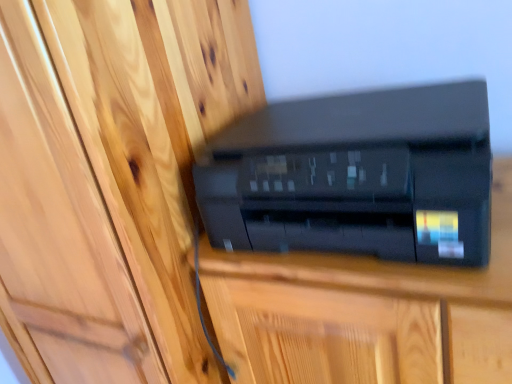
Based on the photo, what is the approximate width of black plastic printer at center?

black plastic printer at center is 40.46 centimeters wide.

In order to face matte wood door at center, should I rotate leftwards or rightwards?

It's best to rotate left around 12.061 degrees.

The image size is (512, 384). In order to click on black plastic printer at center in this screenshot , I will do `click(365, 313)`.

Between point (259, 266) and point (46, 211), which one is positioned behind?

The point (46, 211) is more distant.

In the scene shown: From the image's perspective, does black plastic printer at center appear lower than matte wood door at center?

Indeed, from the image's perspective, black plastic printer at center is shown beneath matte wood door at center.

How many degrees apart are the facing directions of black plastic printer at center and matte wood door at center?

black plastic printer at center and matte wood door at center are facing 0.783 degrees away from each other.

From a real-world perspective, between black plastic printer at center and matte wood door at center, who is vertically lower?

black plastic printer at center, from a real-world perspective.

From a real-world perspective, relative to black plastic printer at center, is matte wood door at center vertically above or below?

Answer: From a real-world perspective, matte wood door at center is physically above black plastic printer at center.

Can you tell me how much matte wood door at center and black plastic printer at center differ in facing direction?

There is a 0.783-degree angle between the facing directions of matte wood door at center and black plastic printer at center.

Between matte wood door at center and black plastic printer at center, which one has larger size?

matte wood door at center.

Does matte wood door at center touch black plastic printer at center?

No, matte wood door at center is not with black plastic printer at center.

Between point (213, 187) and point (252, 278), which one is positioned behind?

The point (213, 187) is behind.

From a real-world perspective, between black plastic printer at center and black plastic printer at center, who is vertically higher?

In real-world perspective, black plastic printer at center is above.

From the image's perspective, who appears lower, black plastic printer at center or black plastic printer at center?

From the image's view, black plastic printer at center is below.

Can you confirm if matte wood door at center is bigger than black plastic printer at center?

Correct, matte wood door at center is larger in size than black plastic printer at center.

From the picture: Is matte wood door at center positioned far away from black plastic printer at center?

No, matte wood door at center is not far away from black plastic printer at center.

Which object is more forward, matte wood door at center or black plastic printer at center?

matte wood door at center is closer to the camera.

Which of these two, matte wood door at center or black plastic printer at center, is wider?

Wider between the two is matte wood door at center.

Is black plastic printer at center touching black plastic printer at center?

No, black plastic printer at center is not beside black plastic printer at center.

Measure the distance between black plastic printer at center and black plastic printer at center.

black plastic printer at center is 4.81 inches away from black plastic printer at center.

From a real-world perspective, is black plastic printer at center below black plastic printer at center?

Indeed, from a real-world perspective, black plastic printer at center is positioned beneath black plastic printer at center.

Which object is further away from the camera, black plastic printer at center or black plastic printer at center?

black plastic printer at center.

From the picture: Based on their positions, is black plastic printer at center located to the left or right of matte wood door at center?

Based on their positions, black plastic printer at center is located to the right of matte wood door at center.

Does black plastic printer at center have a greater width compared to matte wood door at center?

No.

From the image's perspective, which is above, black plastic printer at center or matte wood door at center?

From the image's view, black plastic printer at center is above.

Are black plastic printer at center and matte wood door at center beside each other?

They are not placed beside each other.

What are the coordinates of `furniture below the matte wood door at center (from a real-world perspective)` in the screenshot? It's located at (365, 313).

Find the location of a particular element. The image size is (512, 384). door above the black plastic printer at center (from the image's perspective) is located at coordinates (59, 231).

In the scene shown: Considering their positions, is black plastic printer at center positioned closer to matte wood door at center than black plastic printer at center?

Based on the image, black plastic printer at center appears to be nearer to matte wood door at center.

When comparing their distances from black plastic printer at center, does matte wood door at center or black plastic printer at center seem closer?

black plastic printer at center is closer to black plastic printer at center.

Based on their spatial positions, is black plastic printer at center or matte wood door at center further from black plastic printer at center?

matte wood door at center.

Considering their positions, is black plastic printer at center positioned closer to black plastic printer at center than matte wood door at center?

black plastic printer at center is closer to black plastic printer at center.

From the image, which object appears to be farther from black plastic printer at center, matte wood door at center or black plastic printer at center?

Among the two, matte wood door at center is located further to black plastic printer at center.

When comparing their distances from matte wood door at center, does black plastic printer at center or black plastic printer at center seem further?

black plastic printer at center is positioned further to the anchor matte wood door at center.

At what (x,y) coordinates should I click in order to perform the action: click on printer between matte wood door at center and black plastic printer at center in the horizontal direction. Please return your answer as a coordinate pair (x, y). The height and width of the screenshot is (384, 512). Looking at the image, I should click on (356, 176).